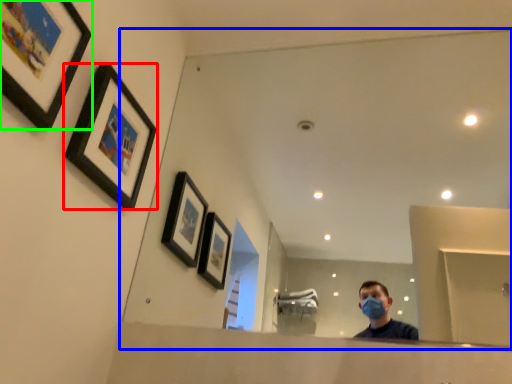
Question: Considering the real-world distances, which object is farthest from picture frame (highlighted by a red box)? mirror (highlighted by a blue box) or picture frame (highlighted by a green box)?

Choices:
 (A) mirror
 (B) picture frame

Answer: (A)